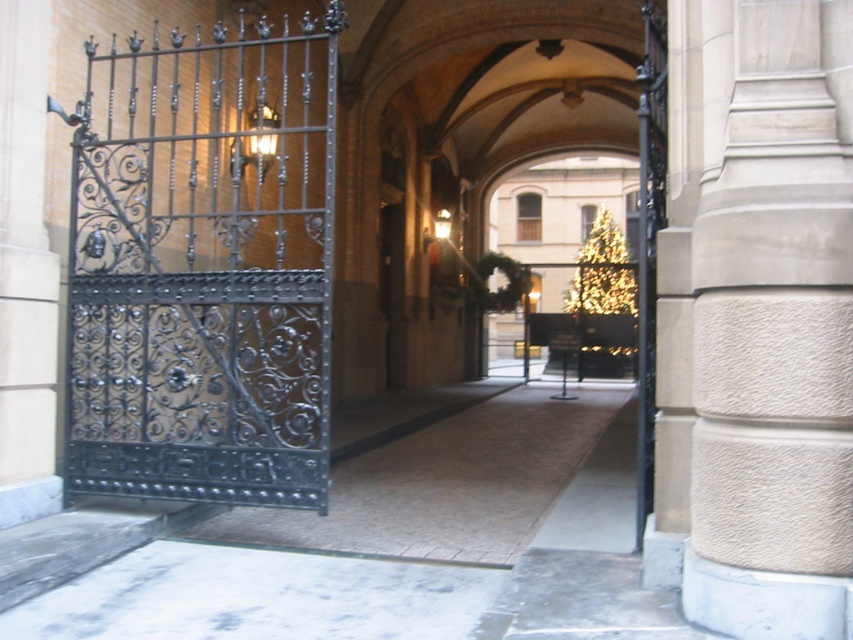
From the picture: You are standing at the entrance of the building and want to take a photo of the black wrought iron gate at left and the smooth stone column at center. Which object should you focus on first if you want to capture both in a single frame without moving the camera?

You should focus on the black wrought iron gate at left first because it is shorter than the smooth stone column at center, allowing both to fit within the frame more easily.